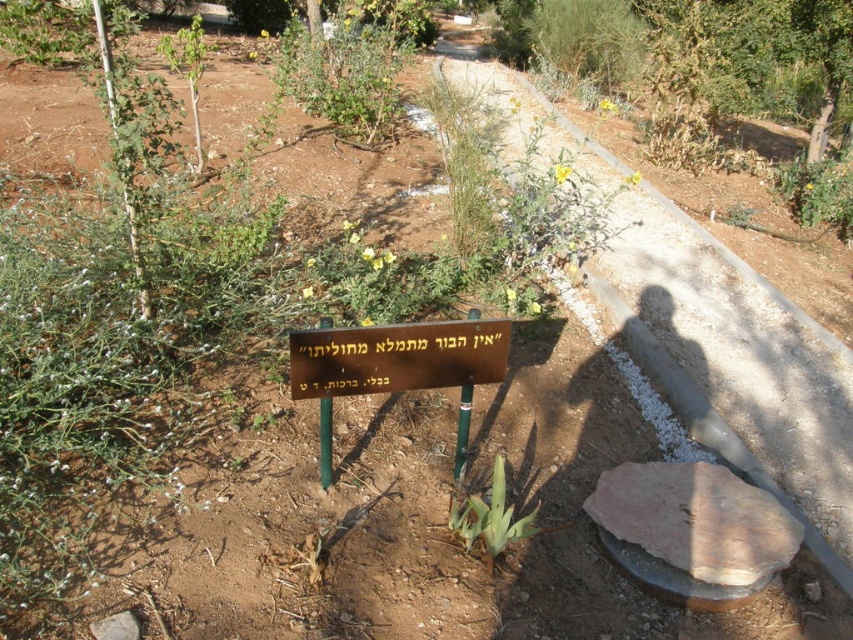
You are standing at the center of the garden and see the point marked at coordinates (692, 529). Based on the scene description, what is the surface material of the ground at that point?

The surface material at point (692, 529) is brown rough stone, as stated in the objects description.